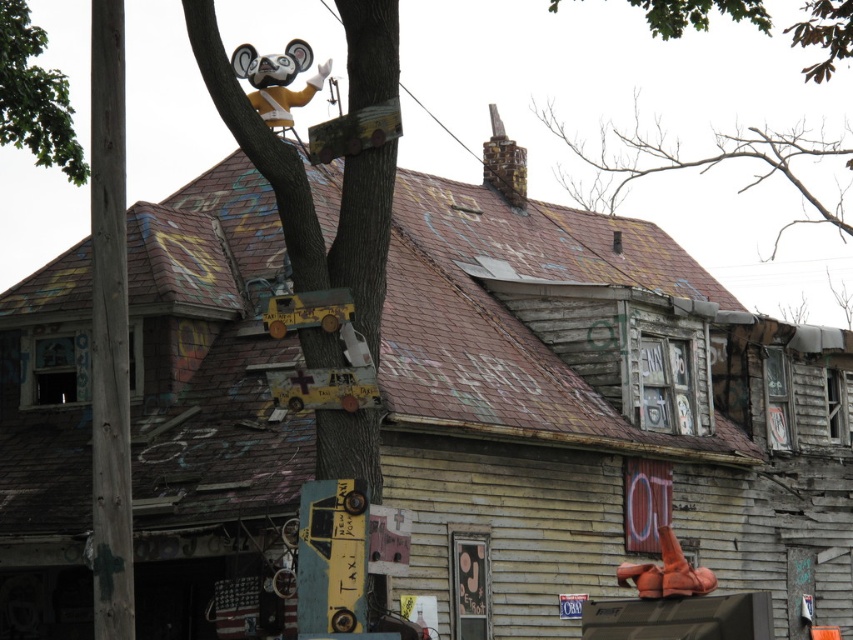
Looking at this image, does brown bark tree at upper center appear on the right side of green leafy tree at upper center?

Indeed, brown bark tree at upper center is positioned on the right side of green leafy tree at upper center.

Is brown bark tree at upper center thinner than green leafy tree at upper center?

No.

Find the location of a particular element. brown bark tree at upper center is located at coordinates point(706,163).

Where is `brown bark tree at upper center`? This screenshot has height=640, width=853. brown bark tree at upper center is located at coordinates (706, 163).

Is wooden tree trunk at upper center to the left of green leafy tree at upper center from the viewer's perspective?

Indeed, wooden tree trunk at upper center is positioned on the left side of green leafy tree at upper center.

Between point (370, 412) and point (827, 38), which one is positioned behind?

Point (827, 38)

The height and width of the screenshot is (640, 853). I want to click on wooden tree trunk at upper center, so click(308, 189).

From the picture: Which is below, wooden tree trunk at upper center or green rough bark tree at upper left?

wooden tree trunk at upper center is lower down.

Who is positioned more to the right, wooden tree trunk at upper center or green rough bark tree at upper left?

wooden tree trunk at upper center is more to the right.

You are a GUI agent. You are given a task and a screenshot of the screen. Output one action in this format:
    pyautogui.click(x=<x>, y=<y>)
    Task: Click on the wooden tree trunk at upper center
    
    Given the screenshot: What is the action you would take?
    pyautogui.click(x=308, y=189)